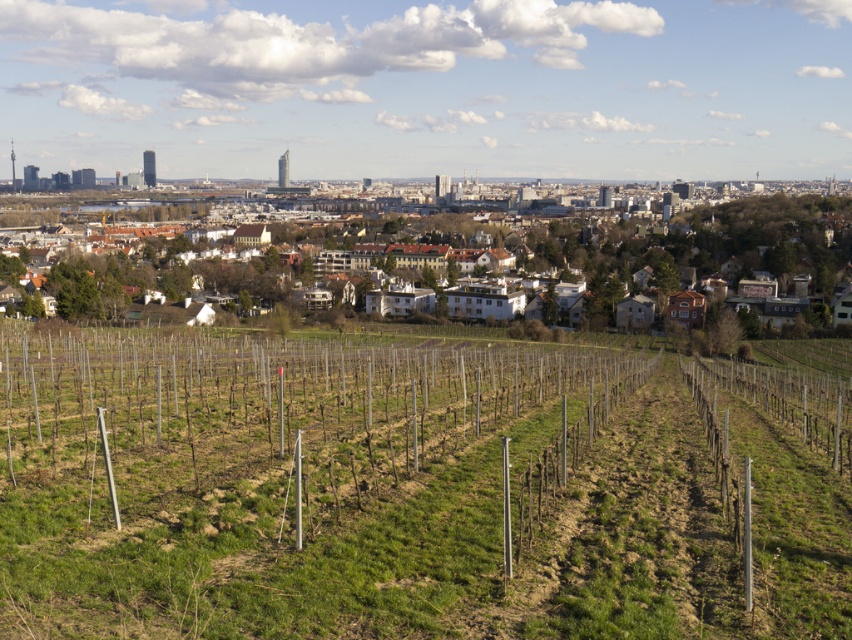
You are a landscape architect analyzing the image to plan a new development. You notice the green grassy hillside at center and the white textured buildings at center. Which area would allow for more construction space based on their current sizes?

The white textured buildings at center occupy more space than the green grassy hillside at center, so the area with white textured buildings at center allows for more construction space.

You are standing at the point marked as point (735, 608) in the image. You want to walk to the city center located 15 meters away from your current position. Can you reach the city center by walking straight ahead?

The distance between point (735, 608) and the viewer is 12.21 meters. Since the city center is 15 meters away from your current position, you can reach it by walking straight ahead as the distance is sufficient.

You are a drone operator who needs to deliver a package to the white textured buildings at center. From your current position above the green grassy hillside at center, which direction should you fly to reach the buildings?

The green grassy hillside at center is positioned under the white textured buildings at center, so you should fly upwards to reach the white textured buildings at center from above the green grassy hillside at center.